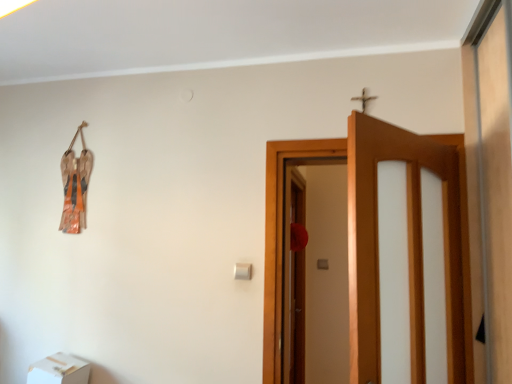
Question: From a real-world perspective, is white cardboard box at lower left below wooden door at center?

Choices:
 (A) yes
 (B) no

Answer: (A)

Question: Is white cardboard box at lower left next to wooden door at center?

Choices:
 (A) no
 (B) yes

Answer: (A)

Question: Is white cardboard box at lower left to the right of wooden door at center from the viewer's perspective?

Choices:
 (A) yes
 (B) no

Answer: (B)

Question: Does white cardboard box at lower left have a greater width compared to wooden door at center?

Choices:
 (A) yes
 (B) no

Answer: (B)

Question: Is there a large distance between white cardboard box at lower left and wooden door at center?

Choices:
 (A) yes
 (B) no

Answer: (A)

Question: From the image's perspective, is white cardboard box at lower left under wooden door at center?

Choices:
 (A) yes
 (B) no

Answer: (A)

Question: Is wooden door at center oriented away from white cardboard box at lower left?

Choices:
 (A) no
 (B) yes

Answer: (A)

Question: Is wooden door at center to the left of white cardboard box at lower left from the viewer's perspective?

Choices:
 (A) no
 (B) yes

Answer: (A)

Question: Is wooden door at center not inside white cardboard box at lower left?

Choices:
 (A) yes
 (B) no

Answer: (A)

Question: Can you confirm if wooden door at center is positioned to the right of white cardboard box at lower left?

Choices:
 (A) yes
 (B) no

Answer: (A)

Question: Can you confirm if wooden door at center is taller than white cardboard box at lower left?

Choices:
 (A) no
 (B) yes

Answer: (B)

Question: From the image's perspective, is wooden door at center located above white cardboard box at lower left?

Choices:
 (A) yes
 (B) no

Answer: (A)

Question: From a real-world perspective, is white cardboard box at lower left positioned above or below wooden door at center?

Choices:
 (A) below
 (B) above

Answer: (A)